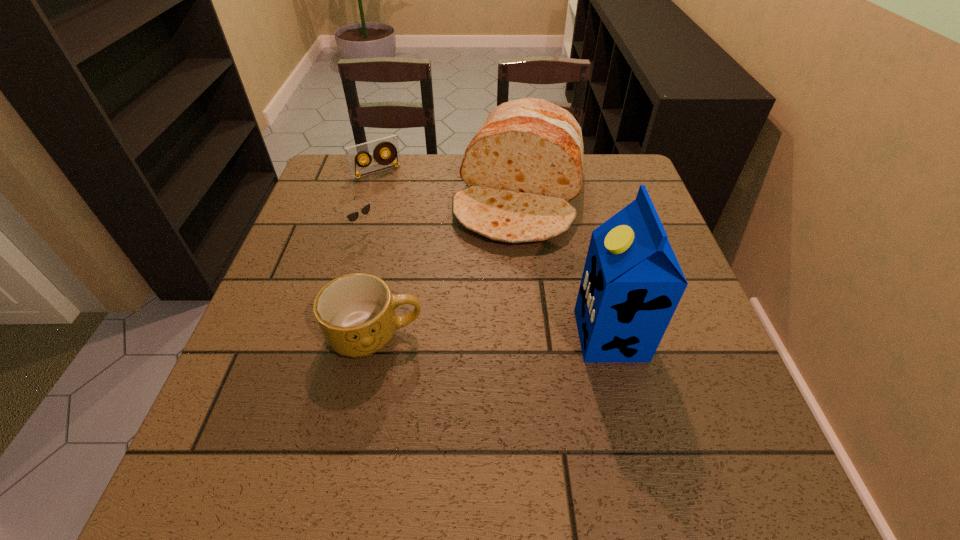
Locate an element on the screen. This screenshot has height=540, width=960. blank space located 0.150m at the front of the videotape with visible reels is located at coordinates (408, 207).

Identify the location of vacant space located 0.070m at the front of the videotape with visible reels. (396, 192).

Where is `free location located 0.260m in front of the lenses of the sunglasses`? free location located 0.260m in front of the lenses of the sunglasses is located at coordinates (455, 299).

In order to click on vacant space located in front of the lenses of the sunglasses in this screenshot , I will do `click(403, 261)`.

I want to click on vacant space located in front of the lenses of the sunglasses, so [444, 292].

At what (x,y) coordinates should I click in order to perform the action: click on vacant space located 0.260m at the sliced end of the second tallest object. Please return your answer as a coordinate pair (x, y). Looking at the image, I should click on (483, 335).

Locate an element on the screen. This screenshot has height=540, width=960. free space located at the sliced end of the second tallest object is located at coordinates (469, 379).

This screenshot has height=540, width=960. I want to click on vacant region located at the sliced end of the second tallest object, so click(x=501, y=273).

Locate an element on the screen. Image resolution: width=960 pixels, height=540 pixels. videotape present at the far edge is located at coordinates (354, 154).

The image size is (960, 540). Find the location of `bread that is at the far edge`. bread that is at the far edge is located at coordinates point(525,163).